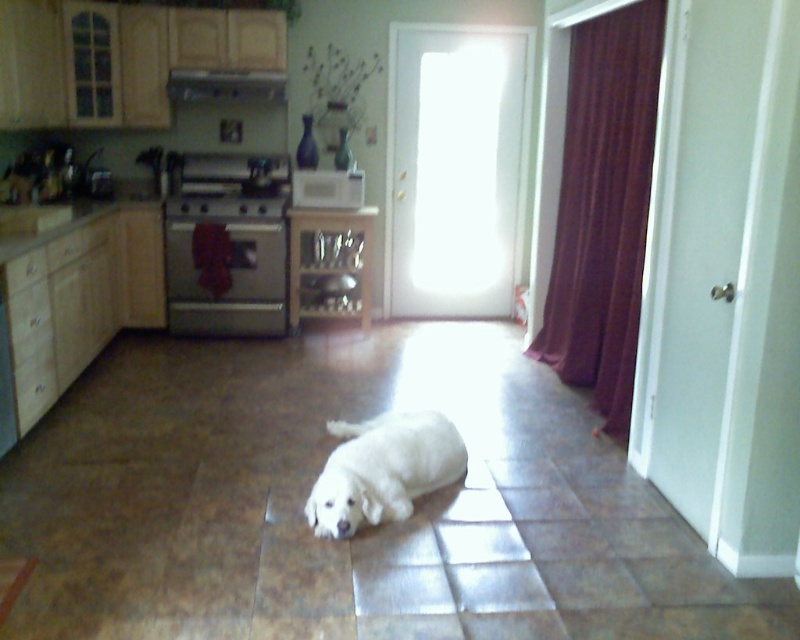
Question: Which point is farther from the camera taking this photo?

Choices:
 (A) (333, 536)
 (B) (196, 173)

Answer: (B)

Question: Which of the following is the farthest from the observer?

Choices:
 (A) (233, 200)
 (B) (397, 467)

Answer: (A)

Question: Does brushed metal stove at center-left appear on the right side of white fur dog at center?

Choices:
 (A) yes
 (B) no

Answer: (B)

Question: Can you confirm if brushed metal stove at center-left is positioned below white fur dog at center?

Choices:
 (A) yes
 (B) no

Answer: (B)

Question: Which of the following is the farthest from the observer?

Choices:
 (A) (400, 504)
 (B) (218, 317)

Answer: (B)

Question: Is brushed metal stove at center-left below white fur dog at center?

Choices:
 (A) no
 (B) yes

Answer: (A)